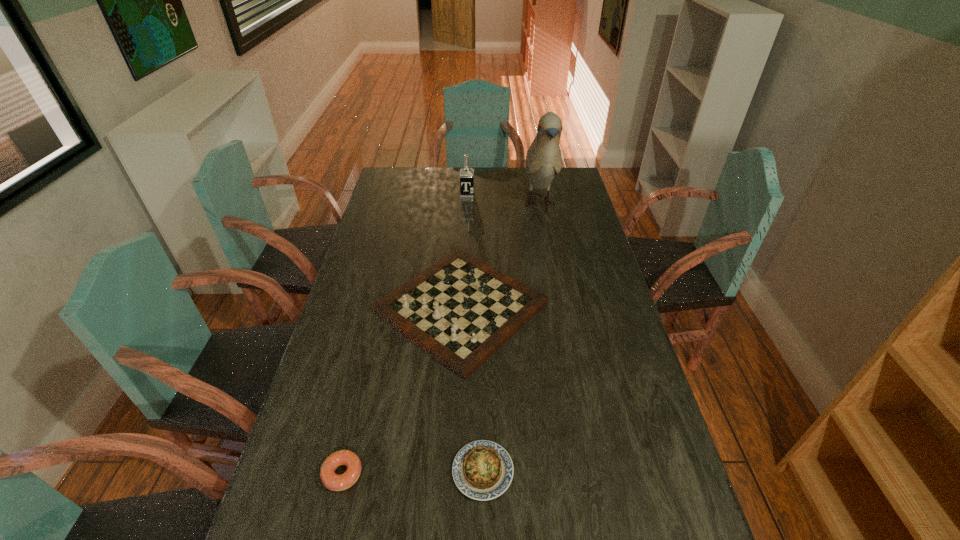
Find the location of a particular element. vacant space at the far left corner is located at coordinates (399, 171).

The width and height of the screenshot is (960, 540). Find the location of `free space at the far right corner of the desktop`. free space at the far right corner of the desktop is located at coordinates (575, 177).

The image size is (960, 540). In order to click on free point between the third tallest object and the vodka in this screenshot , I will do `click(464, 252)`.

Find the location of a particular element. Image resolution: width=960 pixels, height=540 pixels. free space that is in between the third tallest object and the quiche is located at coordinates (472, 389).

Where is `free space that is in between the parakeet and the vodka`? This screenshot has height=540, width=960. free space that is in between the parakeet and the vodka is located at coordinates (503, 199).

Select which object is the fourth closest to the second tallest object. Please provide its 2D coordinates. Your answer should be formatted as a tuple, i.e. [(x, y)], where the tuple contains the x and y coordinates of a point satisfying the conditions above.

[(331, 480)]

At what (x,y) coordinates should I click in order to perform the action: click on object that ranks as the second closest to the shortest object. Please return your answer as a coordinate pair (x, y). The width and height of the screenshot is (960, 540). Looking at the image, I should click on (331, 480).